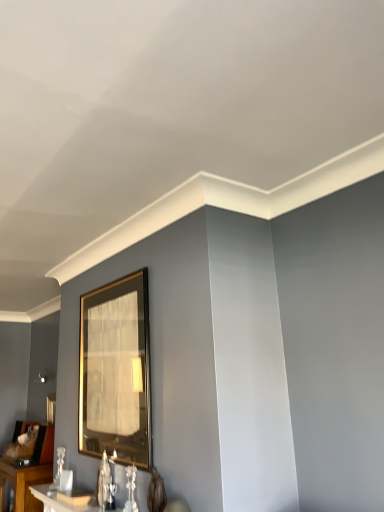
Question: Considering the positions of gold-framed mirror at lower left, which is the second picture frame in top-to-bottom order, and gold metallic picture frame at center, the 2th picture frame when ordered from left to right, in the image, is gold-framed mirror at lower left, which is the second picture frame in top-to-bottom order, bigger or smaller than gold metallic picture frame at center, the 2th picture frame when ordered from left to right,?

Choices:
 (A) small
 (B) big

Answer: (A)

Question: Considering the relative positions of gold-framed mirror at lower left, arranged as the second picture frame when viewed from the right, and gold metallic picture frame at center, which ranks as the first picture frame in top-to-bottom order, in the image provided, is gold-framed mirror at lower left, arranged as the second picture frame when viewed from the right, to the left or to the right of gold metallic picture frame at center, which ranks as the first picture frame in top-to-bottom order,?

Choices:
 (A) left
 (B) right

Answer: (A)

Question: Considering the real-world distances, which object is farthest from the white glossy table at lower left, the 1th table in the front-to-back sequence?

Choices:
 (A) gold-framed mirror at lower left, which is the second picture frame in top-to-bottom order
 (B) gold metallic picture frame at center, which ranks as the first picture frame in top-to-bottom order
 (C) white glossy table at lower left, the first table when ordered from back to front

Answer: (A)

Question: Which object is the farthest from the white glossy table at lower left, the second table from the left?

Choices:
 (A) white glossy table at lower left, marked as the second table in a top-to-bottom arrangement
 (B) gold-framed mirror at lower left, the 2th picture frame when ordered from front to back
 (C) gold metallic picture frame at center, which ranks as the first picture frame in top-to-bottom order

Answer: (B)